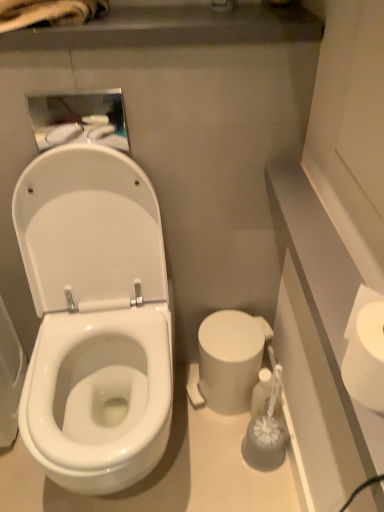
Question: Does white glossy medicine cabinet at upper left appear on the right side of white matte toilet paper at right?

Choices:
 (A) yes
 (B) no

Answer: (B)

Question: Is white matte toilet paper at right surrounded by white glossy medicine cabinet at upper left?

Choices:
 (A) yes
 (B) no

Answer: (B)

Question: Can we say white glossy medicine cabinet at upper left lies outside white matte toilet paper at right?

Choices:
 (A) yes
 (B) no

Answer: (A)

Question: Is white glossy medicine cabinet at upper left at the left side of white matte toilet paper at right?

Choices:
 (A) no
 (B) yes

Answer: (B)

Question: Does white glossy medicine cabinet at upper left have a smaller size compared to white matte toilet paper at right?

Choices:
 (A) no
 (B) yes

Answer: (B)

Question: Considering the relative positions of white glossy medicine cabinet at upper left and white matte toilet paper at right in the image provided, is white glossy medicine cabinet at upper left behind white matte toilet paper at right?

Choices:
 (A) yes
 (B) no

Answer: (A)

Question: From a real-world perspective, is white matte toilet paper at right below white glossy toilet at left?

Choices:
 (A) no
 (B) yes

Answer: (A)

Question: Can you confirm if white matte toilet paper at right is smaller than white glossy toilet at left?

Choices:
 (A) no
 (B) yes

Answer: (B)

Question: From the image's perspective, would you say white matte toilet paper at right is shown under white glossy toilet at left?

Choices:
 (A) yes
 (B) no

Answer: (B)

Question: Does white matte toilet paper at right come in front of white glossy toilet at left?

Choices:
 (A) yes
 (B) no

Answer: (A)

Question: Can you confirm if white matte toilet paper at right is bigger than white glossy toilet at left?

Choices:
 (A) no
 (B) yes

Answer: (A)

Question: Can you see white matte toilet paper at right touching white glossy toilet at left?

Choices:
 (A) no
 (B) yes

Answer: (A)

Question: Considering the relative sizes of white matte toilet paper at right and white glossy medicine cabinet at upper left in the image provided, is white matte toilet paper at right bigger than white glossy medicine cabinet at upper left?

Choices:
 (A) yes
 (B) no

Answer: (A)